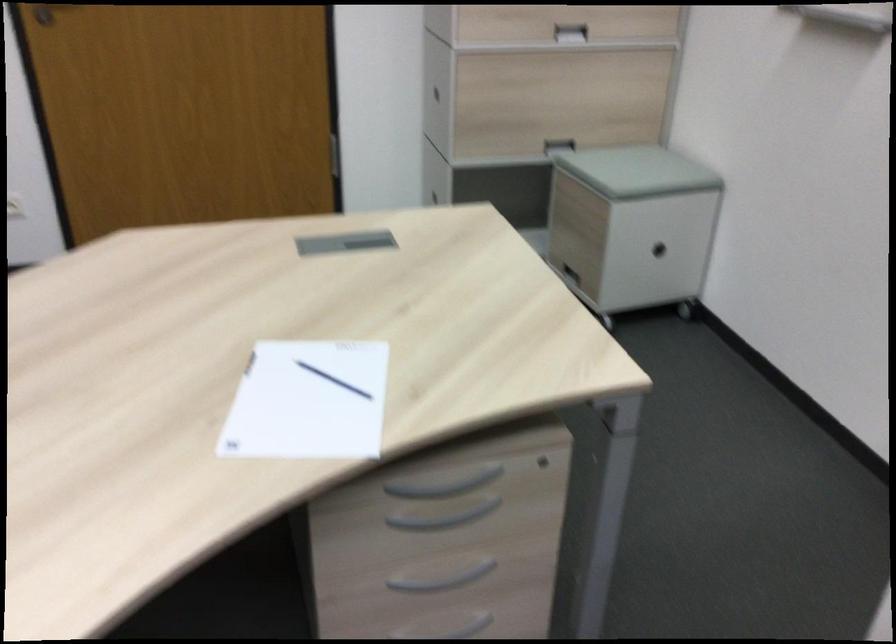
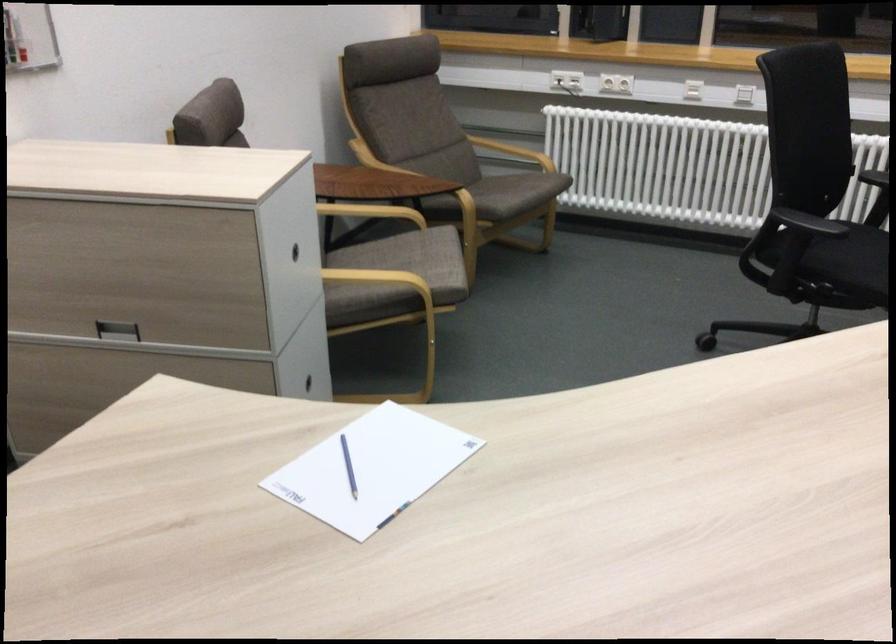
Where in the second image is the point corresponding to point 338,393 from the first image?

(348, 466)